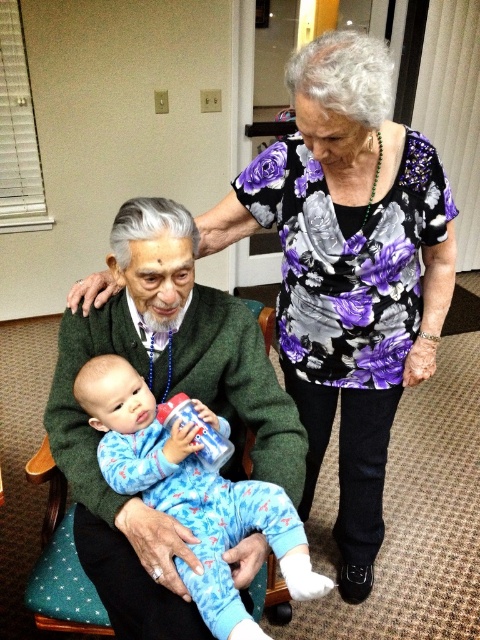
Question: Which object is closer to the camera taking this photo?

Choices:
 (A) blue cotton onesie at center
 (B) floral-patterned blouse at upper center

Answer: (A)

Question: In this image, where is floral-patterned blouse at upper center located relative to blue cotton onesie at center?

Choices:
 (A) left
 (B) right

Answer: (B)

Question: Which point appears farthest from the camera in this image?

Choices:
 (A) (203, 492)
 (B) (238, 205)

Answer: (B)

Question: Which point is closer to the camera taking this photo?

Choices:
 (A) (168, 429)
 (B) (352, 349)

Answer: (A)

Question: Does floral-patterned blouse at upper center appear over blue cotton onesie at center?

Choices:
 (A) yes
 (B) no

Answer: (A)

Question: Does floral-patterned blouse at upper center come behind blue cotton onesie at center?

Choices:
 (A) yes
 (B) no

Answer: (A)